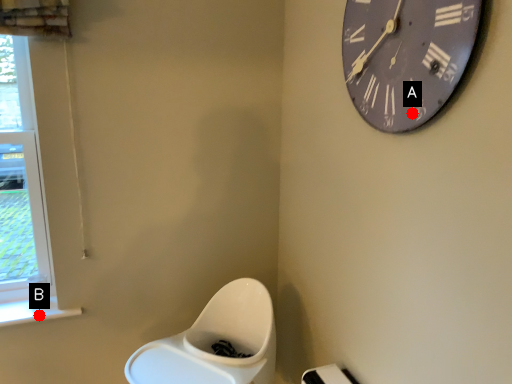
Question: Two points are circled on the image, labeled by A and B beside each circle. Among these points, which one is farthest from the camera?

Choices:
 (A) A is further
 (B) B is further

Answer: (B)